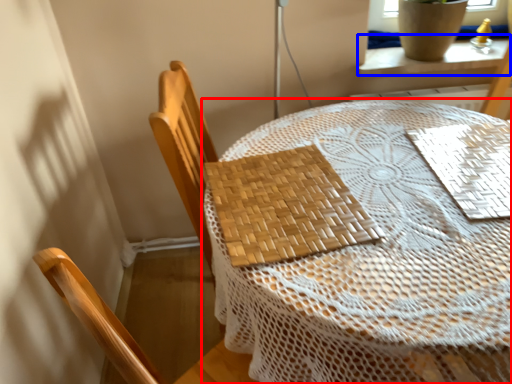
Question: Which of the following is the farthest to the observer, table (highlighted by a red box) or window sill (highlighted by a blue box)?

Choices:
 (A) table
 (B) window sill

Answer: (B)